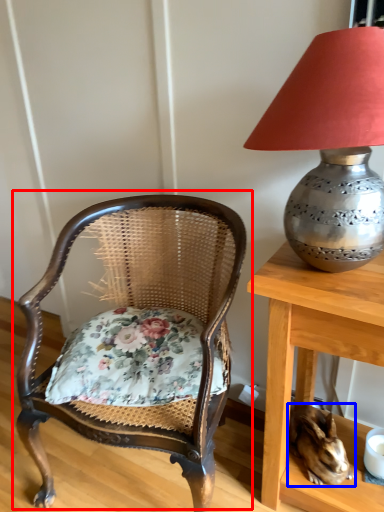
Question: Among these objects, which one is nearest to the camera, chair (highlighted by a red box) or rabbit (highlighted by a blue box)?

Choices:
 (A) chair
 (B) rabbit

Answer: (A)